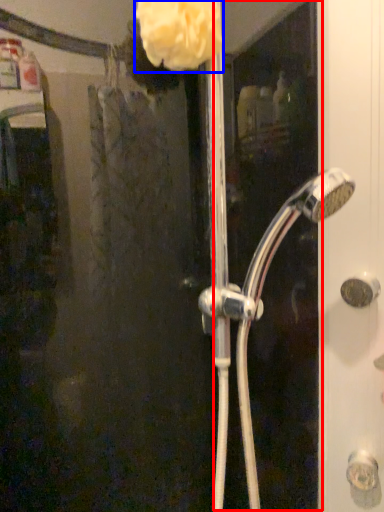
Question: Which point is closer to the camera, screen door (highlighted by a red box) or flower (highlighted by a blue box)?

Choices:
 (A) screen door
 (B) flower

Answer: (A)